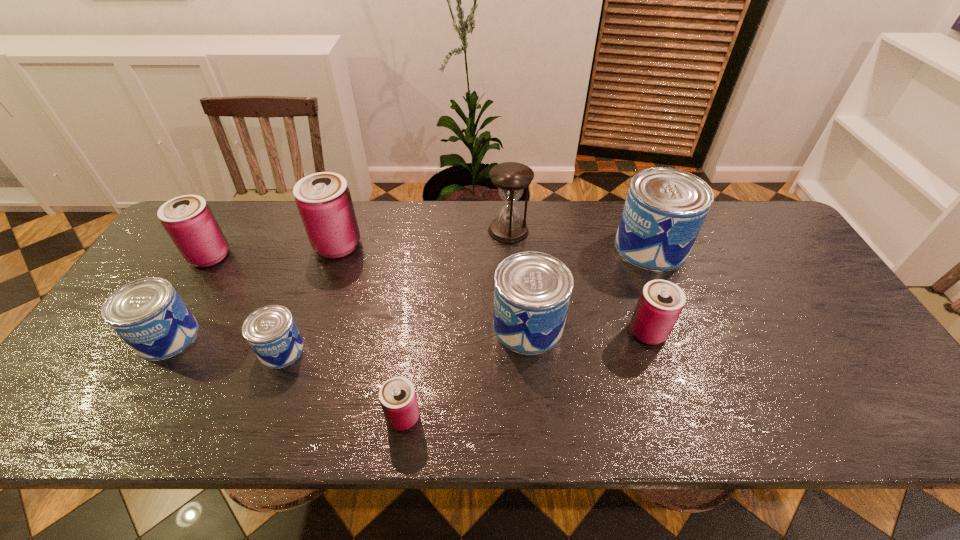
I want to click on free spot that satisfies the following two spatial constraints: 1. on the back side of the hourglass; 2. on the left side of the biggest pink can, so click(x=343, y=231).

This screenshot has height=540, width=960. I want to click on free region that satisfies the following two spatial constraints: 1. on the front label of the biggest blue can; 2. on the front label of the smallest blue can, so click(692, 350).

Where is `vacant space that satisfies the following two spatial constraints: 1. on the front label of the fourth can from right to left; 2. on the right side of the smallest blue can`? vacant space that satisfies the following two spatial constraints: 1. on the front label of the fourth can from right to left; 2. on the right side of the smallest blue can is located at coordinates (256, 417).